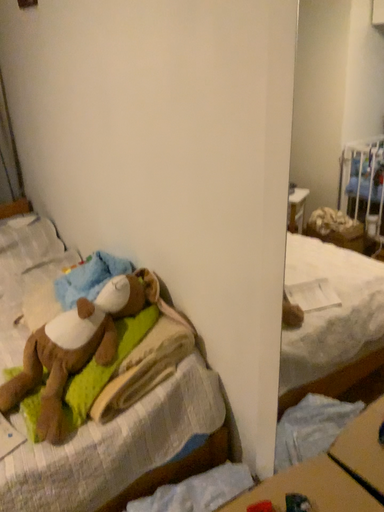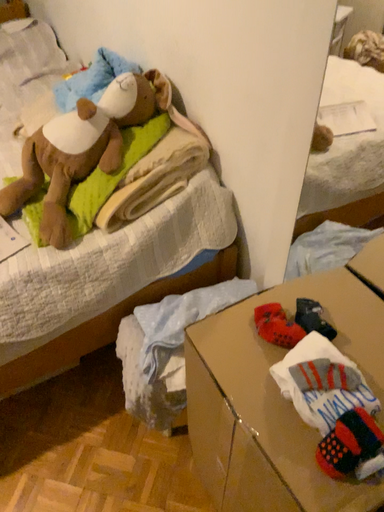
Question: How did the camera likely rotate when shooting the video?

Choices:
 (A) rotated downward
 (B) rotated upward

Answer: (A)